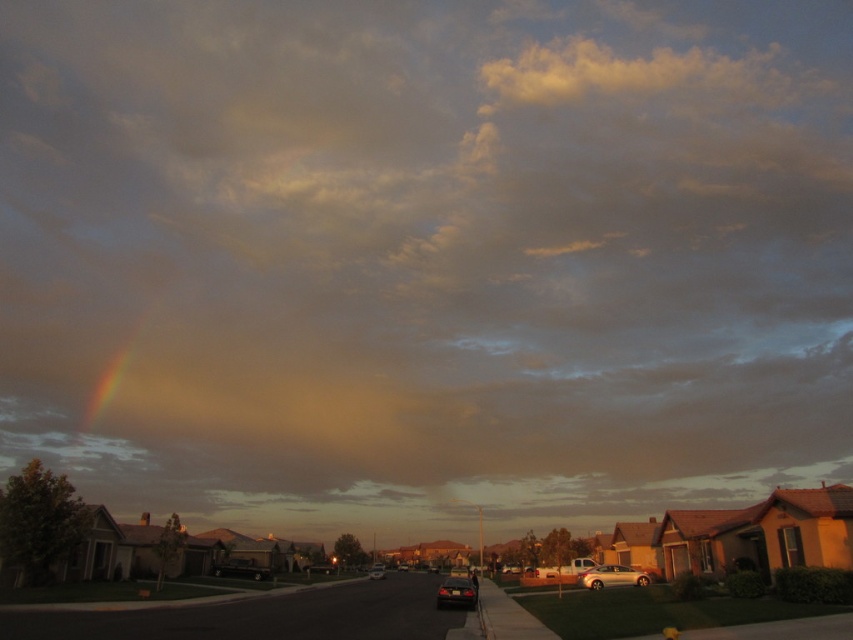
Is shiny black sedan at lower center positioned at the back of shiny black sedan at center?

No, it is in front of shiny black sedan at center.

Is shiny black sedan at lower center to the right of shiny black sedan at center from the viewer's perspective?

Yes, shiny black sedan at lower center is to the right of shiny black sedan at center.

This screenshot has height=640, width=853. What do you see at coordinates (456, 593) in the screenshot? I see `shiny black sedan at lower center` at bounding box center [456, 593].

Locate an element on the screen. The image size is (853, 640). shiny black sedan at lower center is located at coordinates (456, 593).

Between satin silver sedan at center and shiny black sedan at lower center, which one has less height?

Standing shorter between the two is satin silver sedan at center.

Is point (621, 573) positioned behind point (465, 589)?

Yes.

I want to click on satin silver sedan at center, so click(x=611, y=577).

Does point (457, 588) come behind point (380, 570)?

No, it is in front of (380, 570).

Between shiny black sedan at lower center and metallic silver sedan at center, which one is positioned lower?

metallic silver sedan at center is lower down.

Who is more forward, (448, 604) or (370, 570)?

Point (448, 604) is more forward.

Find the location of a particular element. shiny black sedan at lower center is located at coordinates (456, 593).